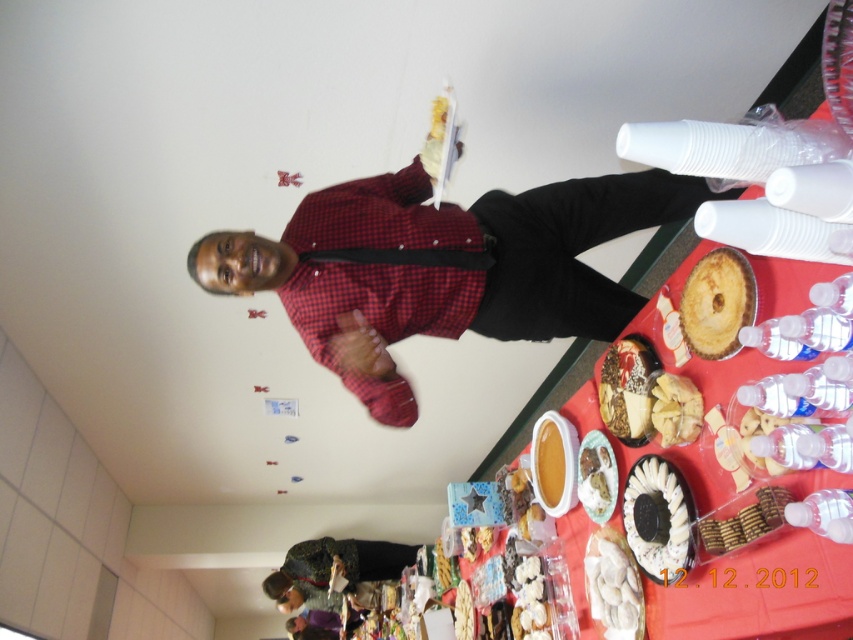
Is the position of smooth brown cookies at lower right less distant than that of yellow matte cake at lower center?

Yes, it is in front of yellow matte cake at lower center.

Can you confirm if smooth brown cookies at lower right is positioned to the right of yellow matte cake at lower center?

Indeed, smooth brown cookies at lower right is positioned on the right side of yellow matte cake at lower center.

This screenshot has width=853, height=640. What do you see at coordinates (743, 518) in the screenshot?
I see `smooth brown cookies at lower right` at bounding box center [743, 518].

What are the coordinates of `smooth brown cookies at lower right` in the screenshot? It's located at (743, 518).

Which is more to the left, white glossy dumplings at center or yellow matte cake at lower center?

Positioned to the left is yellow matte cake at lower center.

Can you confirm if white glossy dumplings at center is bigger than yellow matte cake at lower center?

Yes, white glossy dumplings at center is bigger than yellow matte cake at lower center.

Locate an element on the screen. The height and width of the screenshot is (640, 853). white glossy dumplings at center is located at coordinates (613, 586).

Between shiny chocolate cake at center and white crumbly cake at center, which one has more height?

Standing taller between the two is shiny chocolate cake at center.

Does point (641, 412) come in front of point (669, 390)?

No, it is behind (669, 390).

This screenshot has height=640, width=853. I want to click on shiny chocolate cake at center, so click(628, 388).